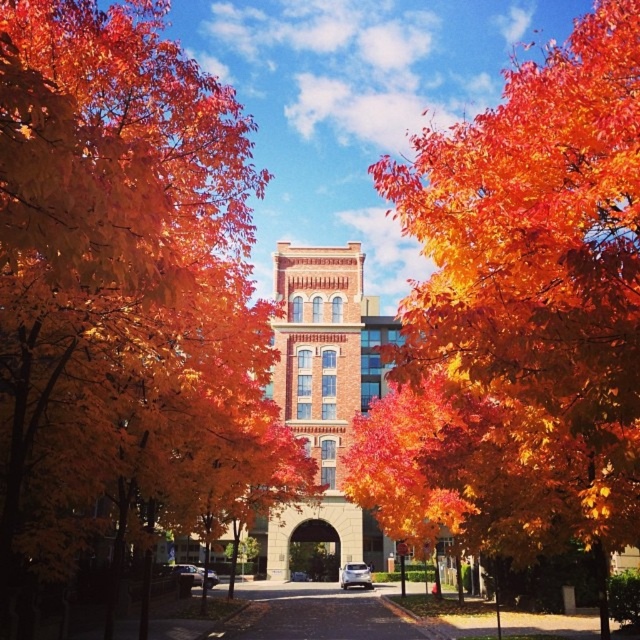
Is shiny orange leaves at center smaller than orange leafy tree at center?

Yes.

This screenshot has height=640, width=640. Describe the element at coordinates (122, 292) in the screenshot. I see `shiny orange leaves at center` at that location.

At what (x,y) coordinates should I click in order to perform the action: click on shiny orange leaves at center. Please return your answer as a coordinate pair (x, y). Looking at the image, I should click on (122, 292).

Where is `shiny orange leaves at center`? This screenshot has height=640, width=640. shiny orange leaves at center is located at coordinates (122, 292).